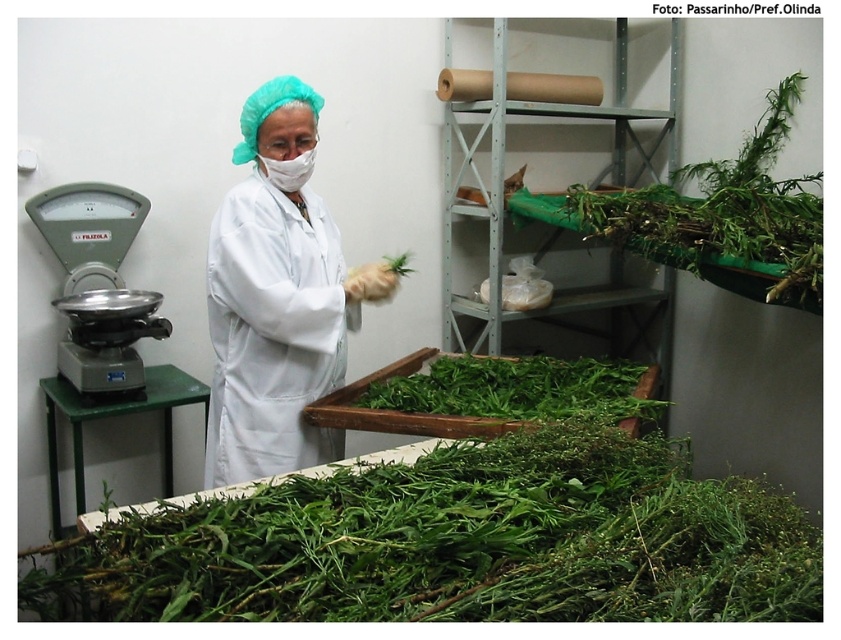
Question: Observing the image, what is the correct spatial positioning of green leafy plant at upper right in reference to green leafy at center?

Choices:
 (A) left
 (B) right

Answer: (B)

Question: Which of the following is the farthest from the observer?

Choices:
 (A) (385, 397)
 (B) (746, 188)
 (C) (221, 285)

Answer: (B)

Question: Does white matte lab coat at center lie behind green leafy plant at upper right?

Choices:
 (A) no
 (B) yes

Answer: (A)

Question: Estimate the real-world distances between objects in this image. Which object is farther from the green leafy at center?

Choices:
 (A) white matte lab coat at center
 (B) green leafy plant at upper right

Answer: (B)

Question: Which point is closer to the camera taking this photo?

Choices:
 (A) (321, 237)
 (B) (657, 195)

Answer: (A)

Question: Can you confirm if white matte lab coat at center is positioned below green leafy at center?

Choices:
 (A) yes
 (B) no

Answer: (B)